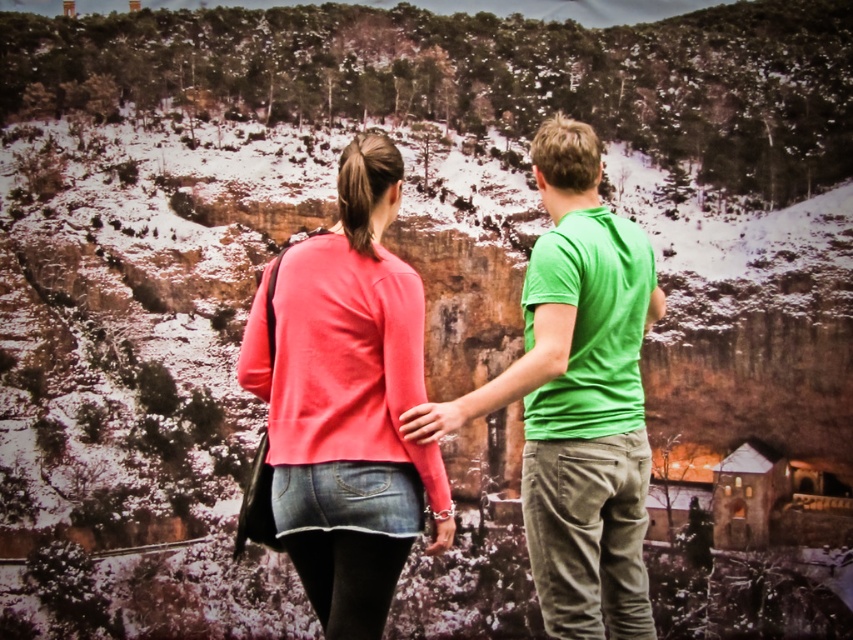
Question: Can you confirm if coral matte sweater at center is positioned below green cotton shirt at center?

Choices:
 (A) yes
 (B) no

Answer: (B)

Question: Does coral matte sweater at center appear on the left side of green cotton shirt at center?

Choices:
 (A) no
 (B) yes

Answer: (B)

Question: Which point appears farthest from the camera in this image?

Choices:
 (A) tap(376, 417)
 (B) tap(538, 268)

Answer: (B)

Question: Does coral matte sweater at center appear under green cotton shirt at center?

Choices:
 (A) no
 (B) yes

Answer: (A)

Question: Which of the following is the closest to the observer?

Choices:
 (A) green cotton shirt at center
 (B) coral matte sweater at center

Answer: (B)